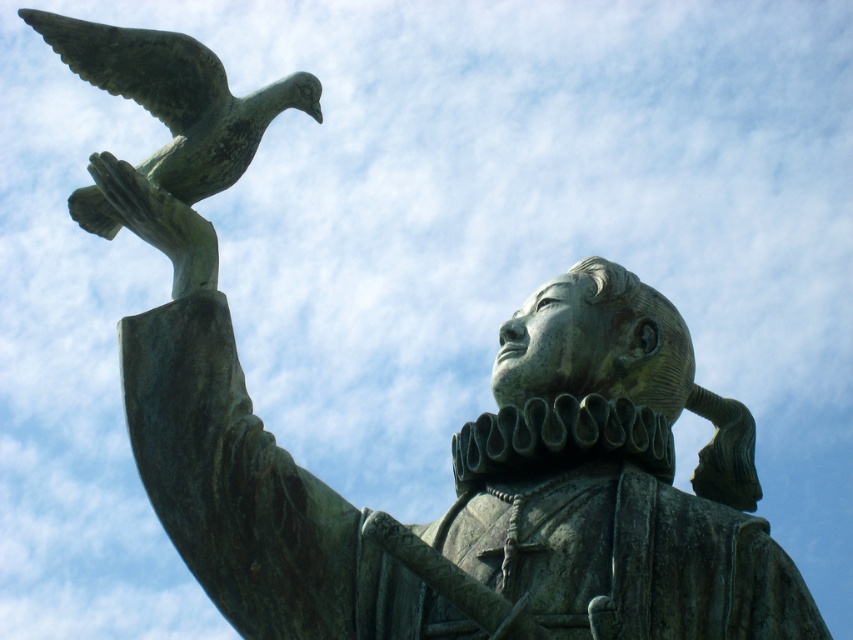
Who is shorter, green patina bird at upper left or bronze statue hand at upper left?

Standing shorter between the two is bronze statue hand at upper left.

Who is positioned more to the right, green patina bird at upper left or bronze statue hand at upper left?

bronze statue hand at upper left is more to the right.

Which is in front, point (175, 88) or point (136, 205)?

Point (136, 205) is more forward.

Find the location of `green patina bird at upper left`. green patina bird at upper left is located at coordinates (177, 97).